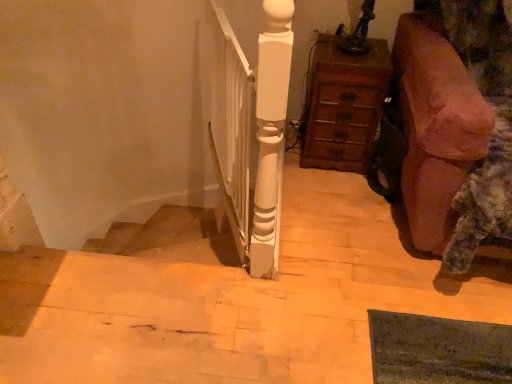
Locate an element on the screen. This screenshot has width=512, height=384. free location in front of wooden chest of drawers at right is located at coordinates (335, 192).